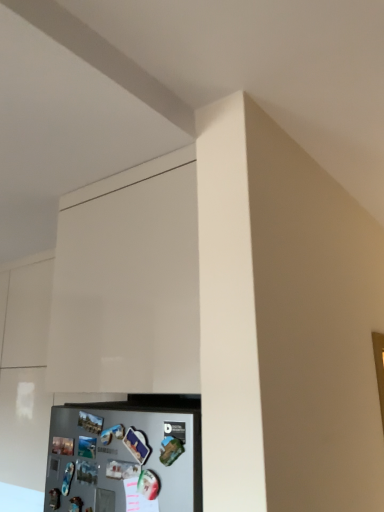
Question: Is white glossy cabinet at upper center taller or shorter than satin silver refrigerator at lower left?

Choices:
 (A) tall
 (B) short

Answer: (A)

Question: From the image's perspective, is white glossy cabinet at upper center located above or below satin silver refrigerator at lower left?

Choices:
 (A) above
 (B) below

Answer: (A)

Question: In the image, is white glossy cabinet at upper center positioned in front of or behind satin silver refrigerator at lower left?

Choices:
 (A) behind
 (B) front

Answer: (A)

Question: Which is correct: satin silver refrigerator at lower left is inside white glossy cabinet at upper center, or outside of it?

Choices:
 (A) inside
 (B) outside

Answer: (B)

Question: Is satin silver refrigerator at lower left in front of or behind white glossy cabinet at upper center in the image?

Choices:
 (A) behind
 (B) front

Answer: (B)

Question: Is point (180, 509) positioned closer to the camera than point (104, 318)?

Choices:
 (A) farther
 (B) closer

Answer: (B)

Question: From the image's perspective, relative to white glossy cabinet at upper center, is satin silver refrigerator at lower left above or below?

Choices:
 (A) above
 (B) below

Answer: (B)